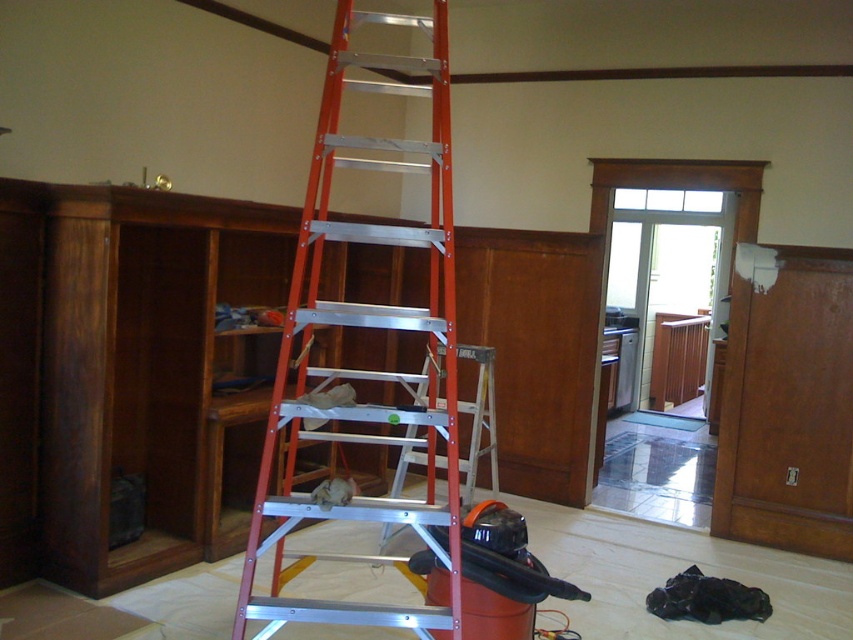
Between orange metallic ladder at center and red aluminum ladder at center, which one appears on the left side from the viewer's perspective?

Positioned to the left is orange metallic ladder at center.

At what (x,y) coordinates should I click in order to perform the action: click on orange metallic ladder at center. Please return your answer as a coordinate pair (x, y). This screenshot has width=853, height=640. Looking at the image, I should click on (364, 326).

Measure the distance between point (x=426, y=406) and camera.

Point (x=426, y=406) is 3.19 meters away from camera.

The image size is (853, 640). Find the location of `orange metallic ladder at center`. orange metallic ladder at center is located at coordinates (364, 326).